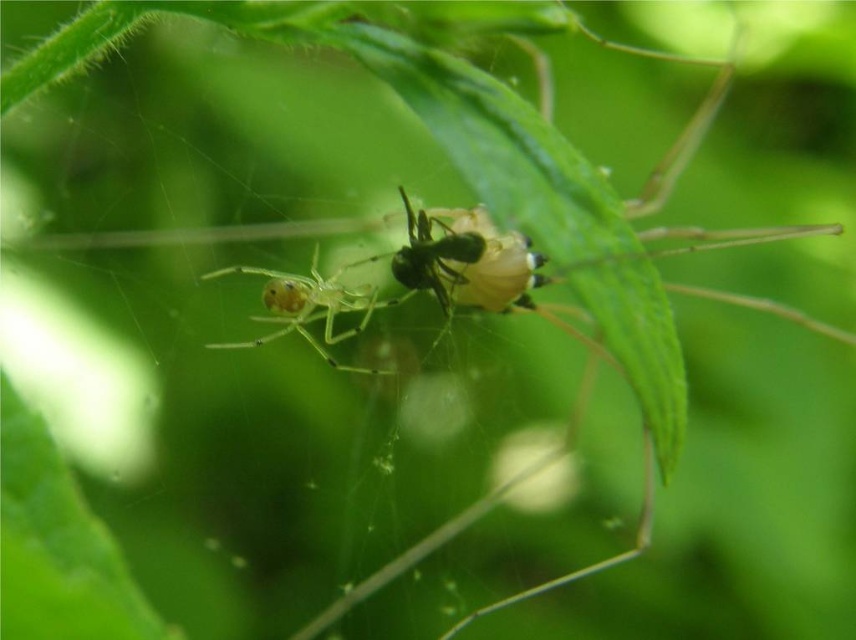
Question: Which point appears closest to the camera in this image?

Choices:
 (A) (247, 269)
 (B) (443, 296)

Answer: (B)

Question: In this image, where is translucent green spider at center located relative to translucent yellowish-green ant at center?

Choices:
 (A) left
 (B) right

Answer: (A)

Question: Does translucent green spider at center lie in front of translucent yellowish-green ant at center?

Choices:
 (A) yes
 (B) no

Answer: (B)

Question: Does translucent green spider at center lie behind translucent yellowish-green ant at center?

Choices:
 (A) no
 (B) yes

Answer: (B)

Question: Which of the following is the closest to the observer?

Choices:
 (A) translucent green spider at center
 (B) translucent yellowish-green ant at center

Answer: (B)